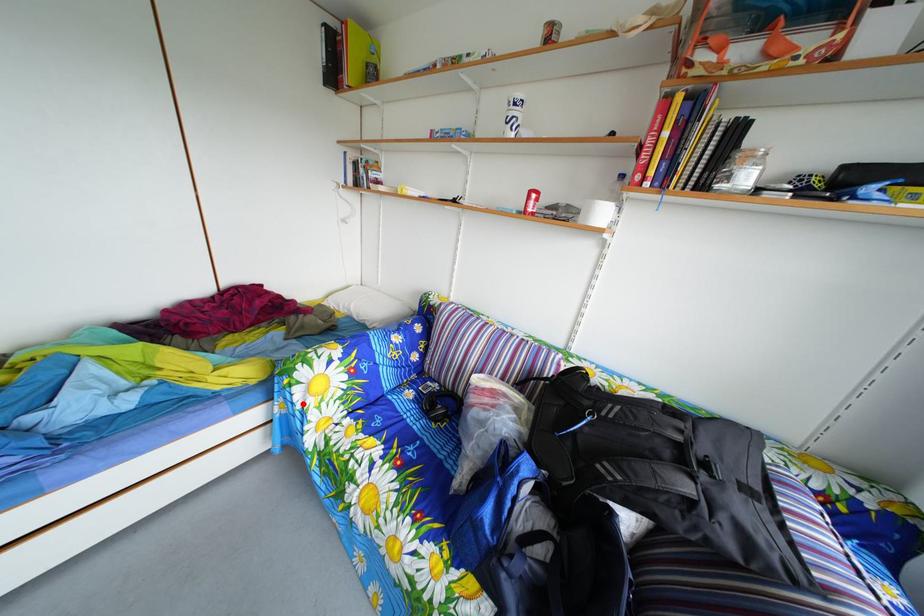
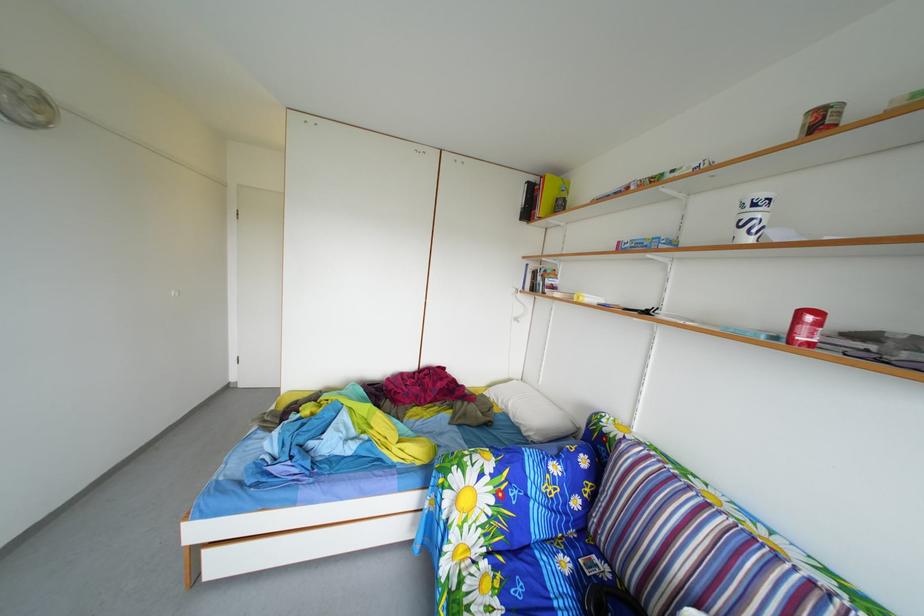
The point at the highlighted location is marked in the first image. Where is the corresponding point in the second image?

(453, 507)